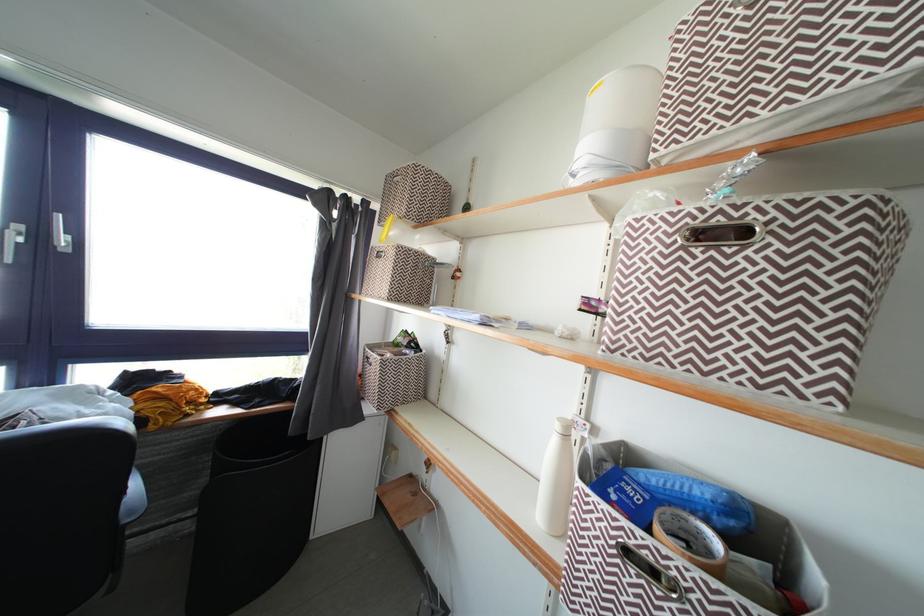
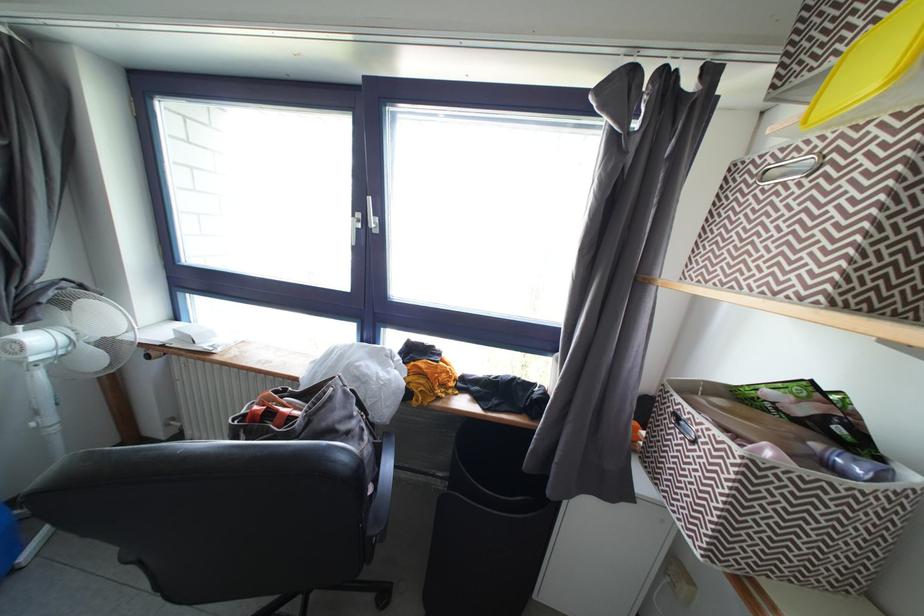
Question: The first image is from the beginning of the video and the second image is from the end. How did the camera likely rotate when shooting the video?

Choices:
 (A) Left
 (B) Right
 (C) Up
 (D) Down

Answer: (A)